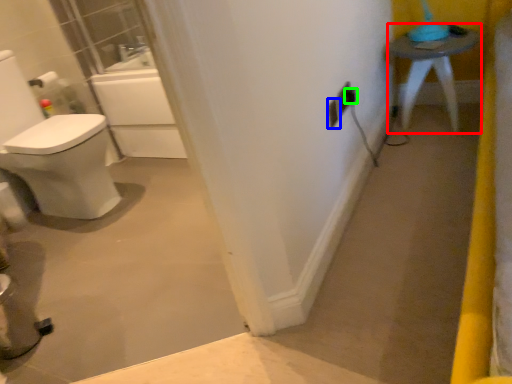
Question: Based on their relative distances, which object is nearer to furniture (highlighted by a red box)? Choose from electric outlet (highlighted by a blue box) and electric outlet (highlighted by a green box).

Choices:
 (A) electric outlet
 (B) electric outlet

Answer: (B)